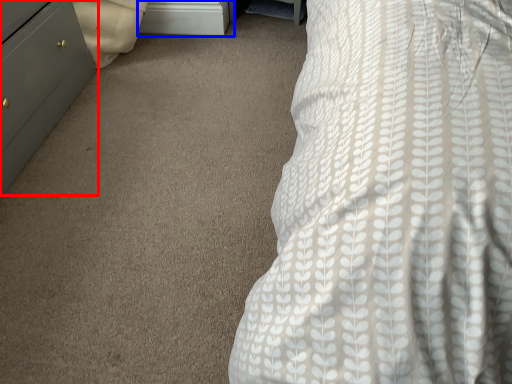
Question: Which point is closer to the camera, chest of drawers (highlighted by a red box) or file cabinet (highlighted by a blue box)?

Choices:
 (A) chest of drawers
 (B) file cabinet

Answer: (A)